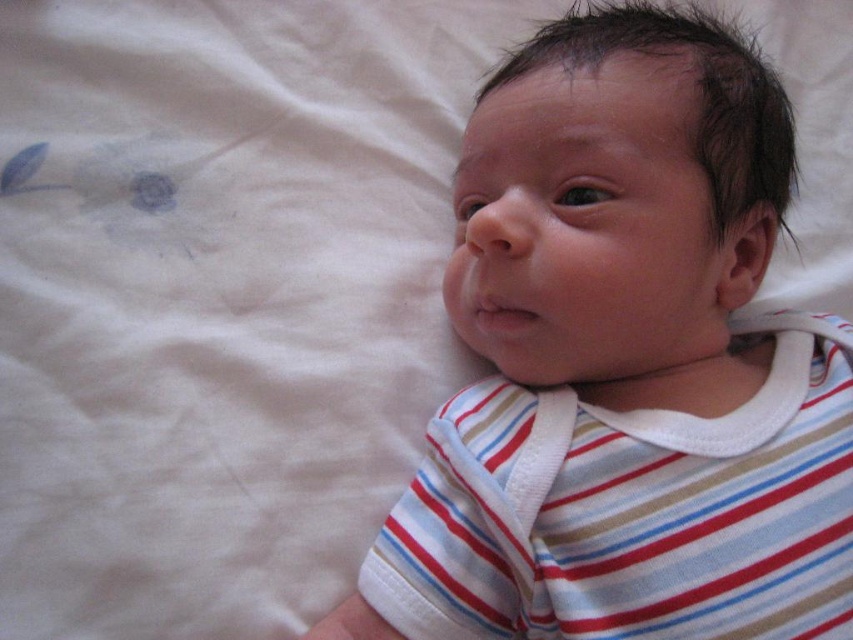
Question: Which point is farther to the camera?

Choices:
 (A) striped cotton shirt at center
 (B) white striped shirt at center

Answer: (B)

Question: Which of the following is the closest to the observer?

Choices:
 (A) (554, 467)
 (B) (595, 531)

Answer: (B)

Question: Observing the image, what is the correct spatial positioning of white striped shirt at center in reference to striped cotton shirt at center?

Choices:
 (A) left
 (B) right

Answer: (A)

Question: Is white striped shirt at center smaller than striped cotton shirt at center?

Choices:
 (A) no
 (B) yes

Answer: (A)

Question: Among these objects, which one is nearest to the camera?

Choices:
 (A) white striped shirt at center
 (B) striped cotton shirt at center

Answer: (B)

Question: Is white striped shirt at center below striped cotton shirt at center?

Choices:
 (A) no
 (B) yes

Answer: (A)